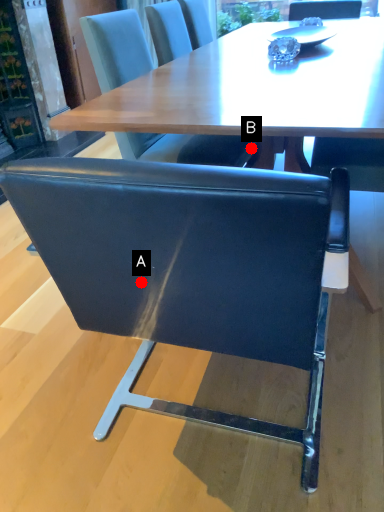
Question: Two points are circled on the image, labeled by A and B beside each circle. Which of the following is the closest to the observer?

Choices:
 (A) A is closer
 (B) B is closer

Answer: (A)